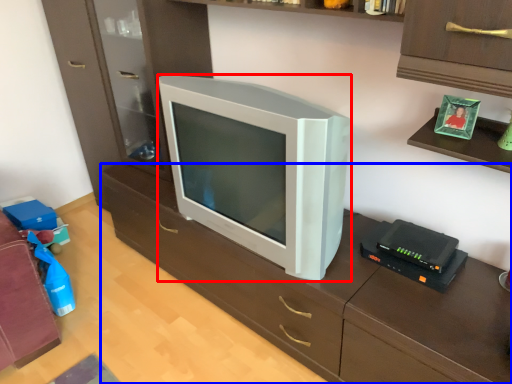
Question: Which object appears closest to the camera in this image, television (highlighted by a red box) or computer desk (highlighted by a blue box)?

Choices:
 (A) television
 (B) computer desk

Answer: (B)